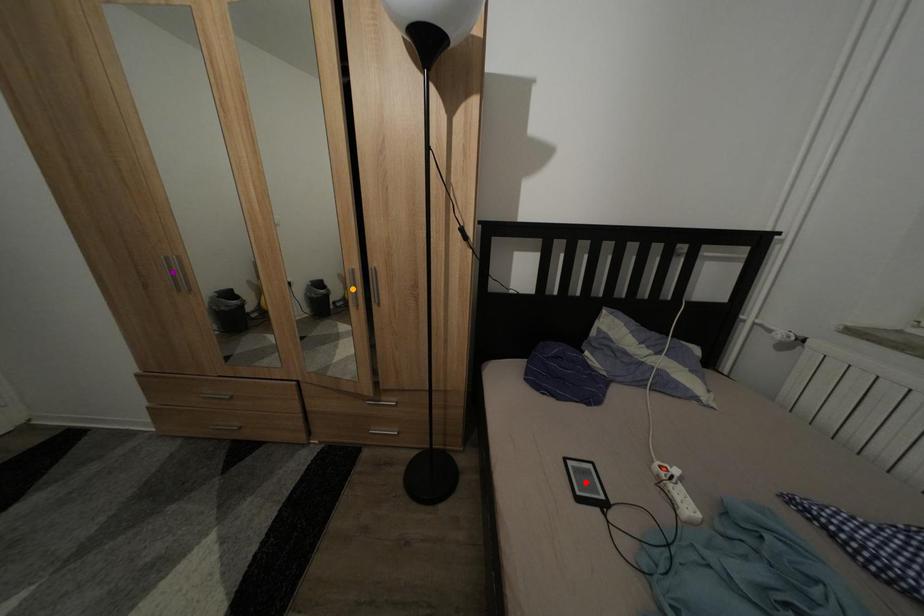
Order these from farthest to nearest:
purple point, red point, orange point

orange point, purple point, red point